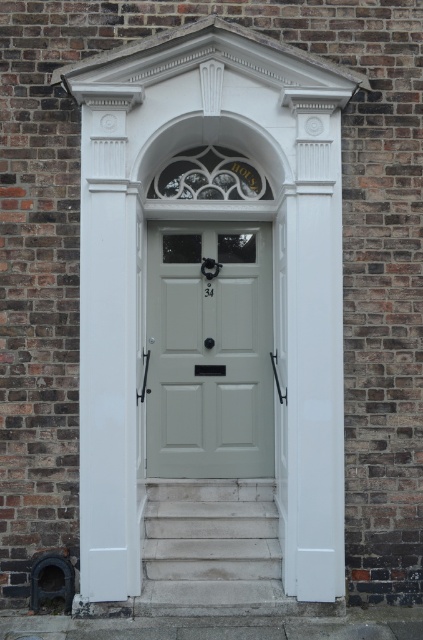
Question: Does satin white door at center have a greater width compared to white stone stairs at lower center?

Choices:
 (A) yes
 (B) no

Answer: (B)

Question: Can you confirm if satin white door at center is positioned below white stone stairs at lower center?

Choices:
 (A) no
 (B) yes

Answer: (A)

Question: Does satin white door at center appear over white stone stairs at lower center?

Choices:
 (A) yes
 (B) no

Answer: (A)

Question: Which point is farther to the camera?

Choices:
 (A) satin white door at center
 (B) white stone stairs at lower center

Answer: (A)